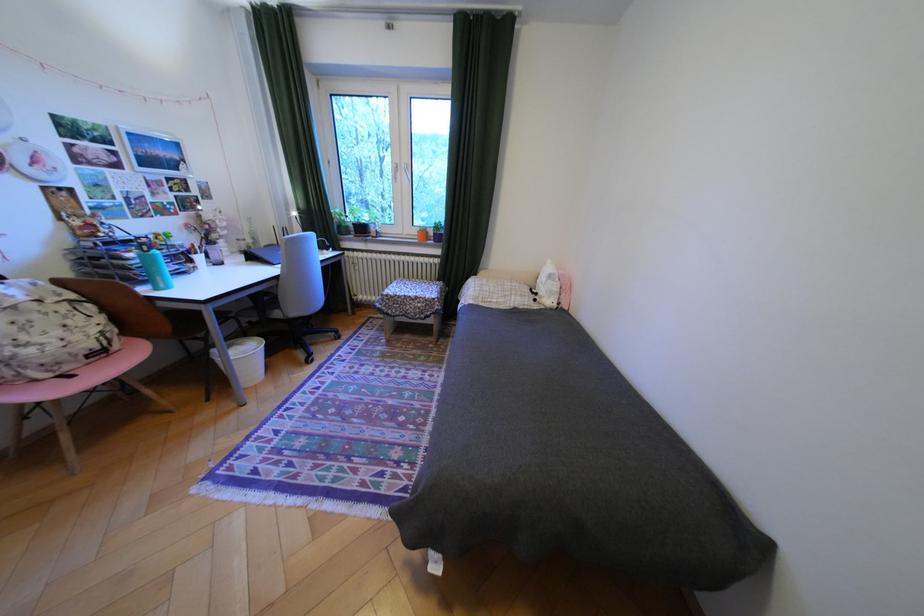
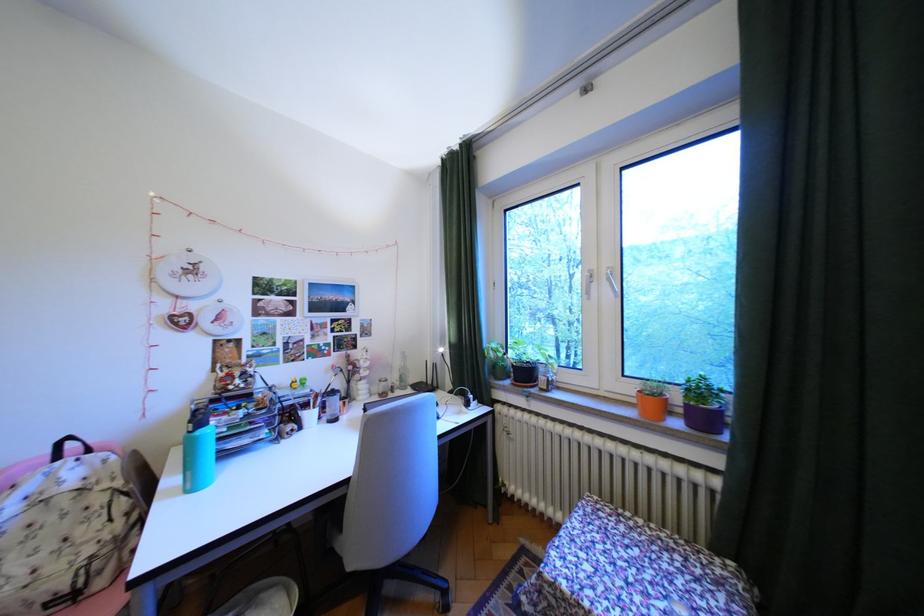
Where in the second image is the point corresponding to (x=427, y=232) from the first image?

(641, 390)